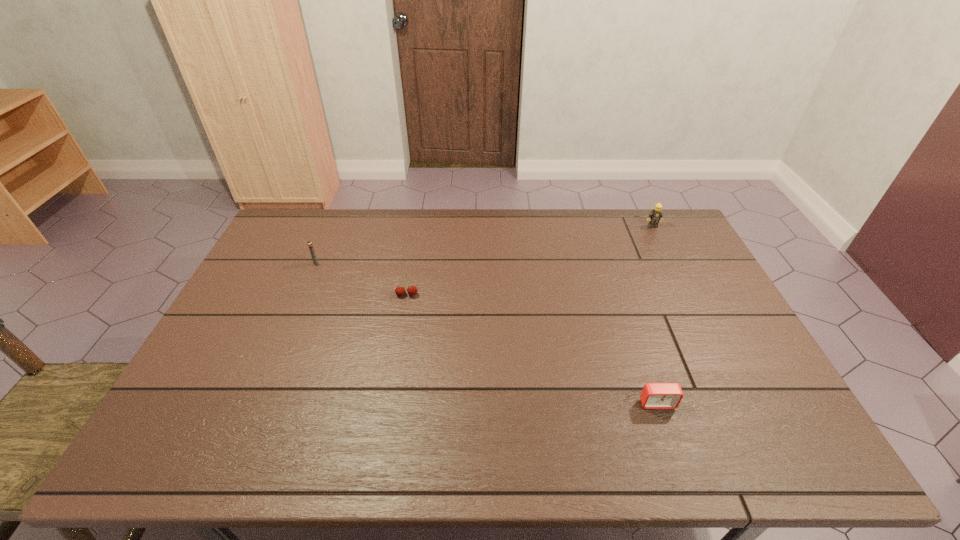
Image resolution: width=960 pixels, height=540 pixels. Find the location of `blank region between the rightmost object and the third nearest object`. blank region between the rightmost object and the third nearest object is located at coordinates (484, 245).

Point out which object is positioned as the nearest to the second object from left to right. Please provide its 2D coordinates. Your answer should be formatted as a tuple, i.e. [(x, y)], where the tuple contains the x and y coordinates of a point satisfying the conditions above.

[(309, 243)]

Identify which object is the nearest to the third nearest object. Please provide its 2D coordinates. Your answer should be formatted as a tuple, i.e. [(x, y)], where the tuple contains the x and y coordinates of a point satisfying the conditions above.

[(412, 290)]